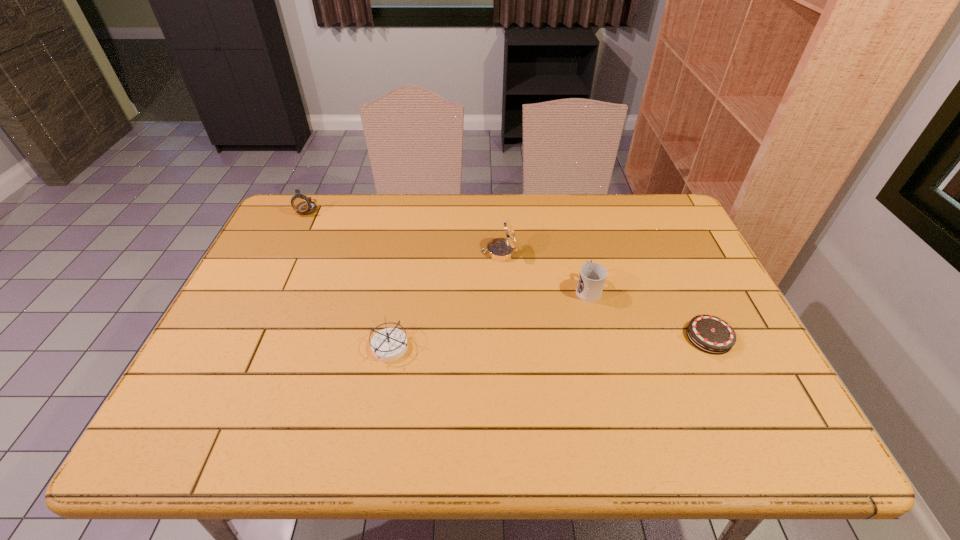
Find the location of a particular element. The height and width of the screenshot is (540, 960). blank space located 0.110m with the dial facing the rightmost compass is located at coordinates (445, 252).

The height and width of the screenshot is (540, 960). I want to click on vacant region located with the dial facing the rightmost compass, so click(x=435, y=252).

Where is `blank space located 0.180m with the dial facing the rightmost compass`? Image resolution: width=960 pixels, height=540 pixels. blank space located 0.180m with the dial facing the rightmost compass is located at coordinates (422, 252).

Where is `vacant space located on the face of the leftmost compass`? vacant space located on the face of the leftmost compass is located at coordinates (284, 256).

Find the location of a particular element. free space located 0.150m on the handle side of the cup is located at coordinates (576, 243).

At what (x,y) coordinates should I click in order to perform the action: click on vacant space located on the handle side of the cup. Please return your answer as a coordinate pair (x, y). Looking at the image, I should click on (573, 229).

The height and width of the screenshot is (540, 960). In order to click on blank space located on the handle side of the cup in this screenshot , I will do `click(565, 198)`.

You are a GUI agent. You are given a task and a screenshot of the screen. Output one action in this format:
    pyautogui.click(x=<x>, y=<y>)
    Task: Click on the vacant space positioned on the front of the second shortest object
    The width and height of the screenshot is (960, 540).
    Given the screenshot: What is the action you would take?
    pyautogui.click(x=376, y=428)

Image resolution: width=960 pixels, height=540 pixels. Identify the location of free space located on the back of the shortest object. (666, 245).

Identify the location of object that is at the far edge. (302, 204).